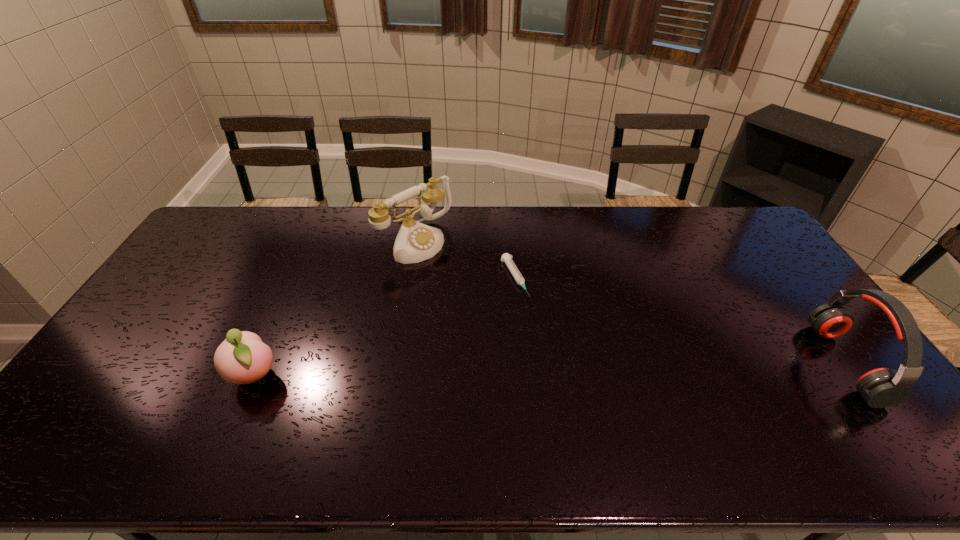
This screenshot has height=540, width=960. Find the location of `free space in the image that satisfies the following two spatial constraints: 1. on the back side of the second shortest object; 2. on the right side of the telephone`. free space in the image that satisfies the following two spatial constraints: 1. on the back side of the second shortest object; 2. on the right side of the telephone is located at coordinates (315, 240).

Locate an element on the screen. The width and height of the screenshot is (960, 540). free region that satisfies the following two spatial constraints: 1. on the back side of the rightmost object; 2. on the ear cups of the third tallest object is located at coordinates (260, 363).